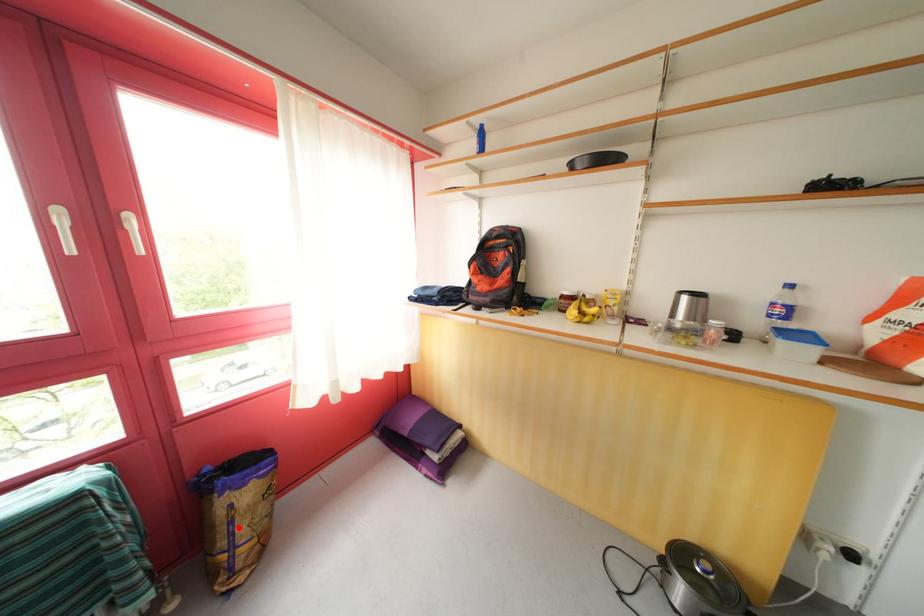
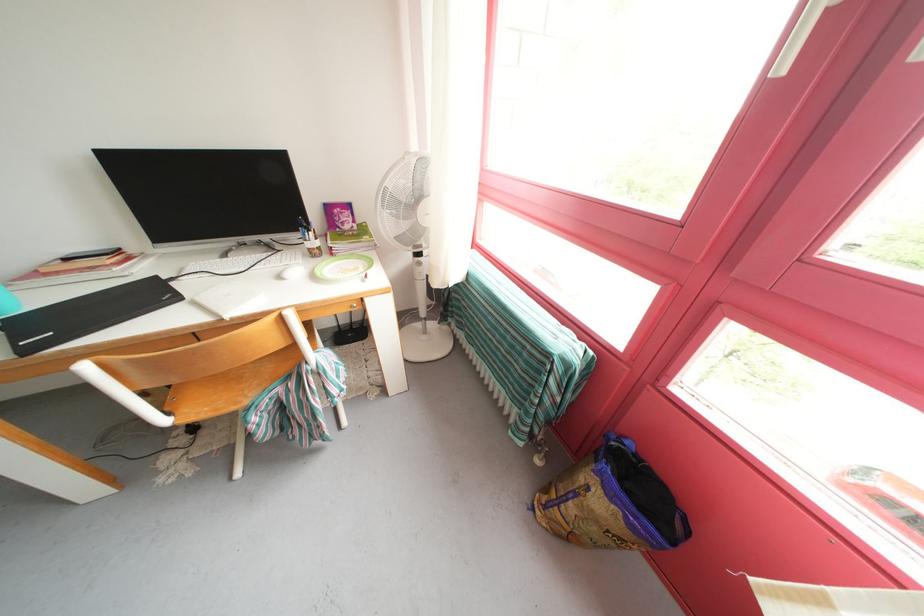
Locate, in the second image, the point that corresponds to the highlighted location in the first image.

(582, 499)